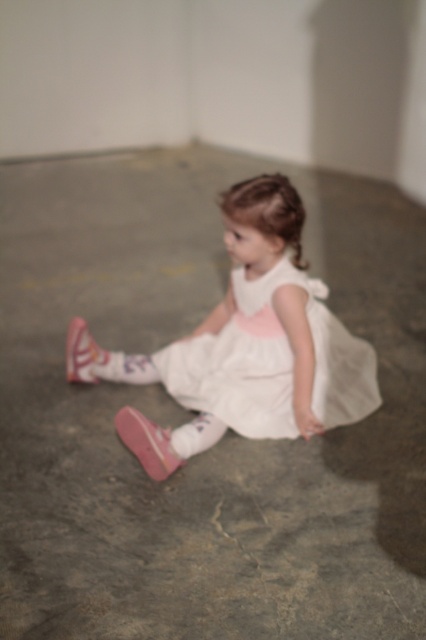
You are a photographer adjusting your camera to focus on two points in the scene. The first point is point [155,369] and the second is point [195,451]. Which point should you focus on first if you want to capture the closest object to the camera?

Point [155,369] is closer to the viewer than point [195,451], so you should focus on point [155,369] first to capture the closest object.

You are a fashion designer observing the child in the scene. You need to decide which item, the pink fabric dress at center or the pink suede sneaker at lower left, requires more fabric to create. Based on their sizes, which one would need more material?

The pink fabric dress at center requires more fabric to create because it has a larger size compared to the pink suede sneaker at lower left.